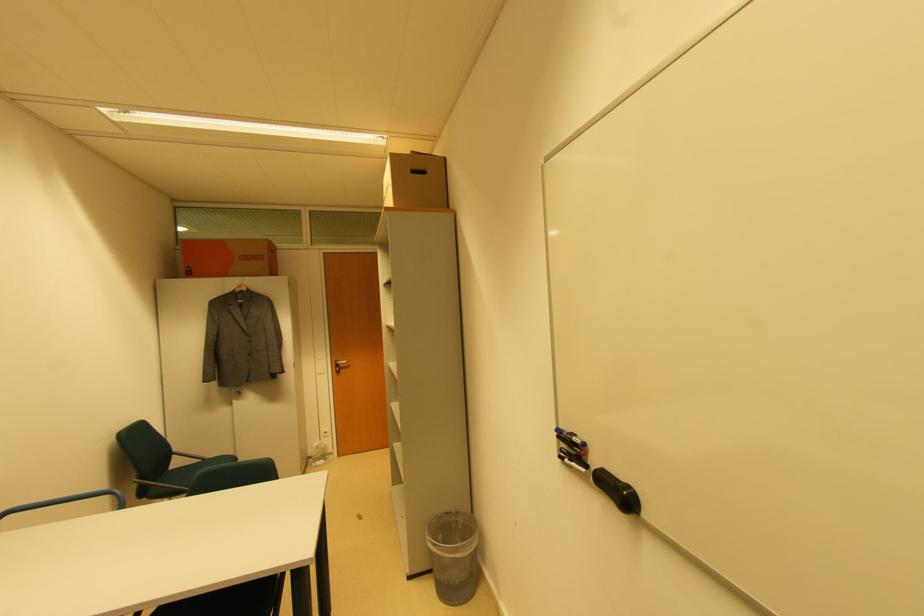
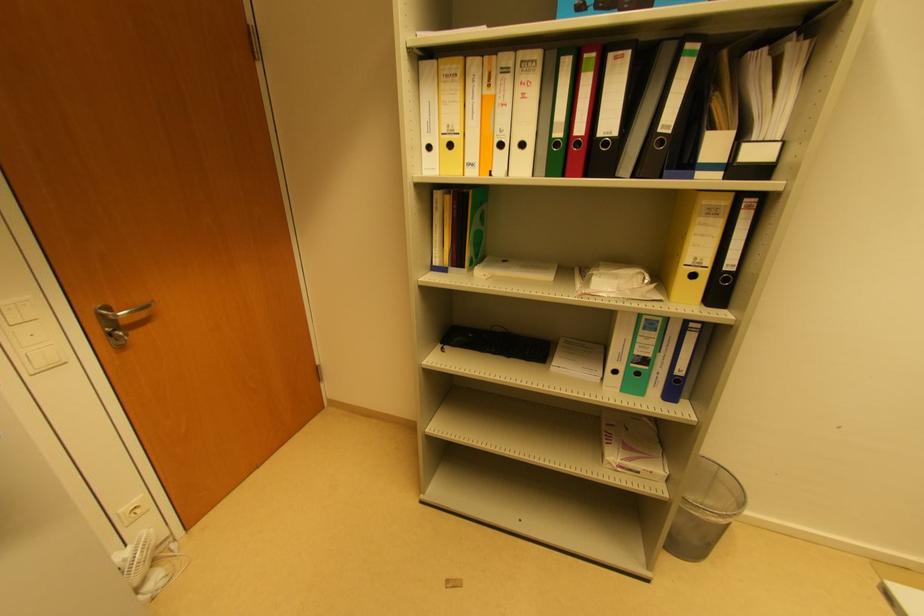
The point at (322, 464) is marked in the first image. Where is the corresponding point in the second image?

(157, 580)